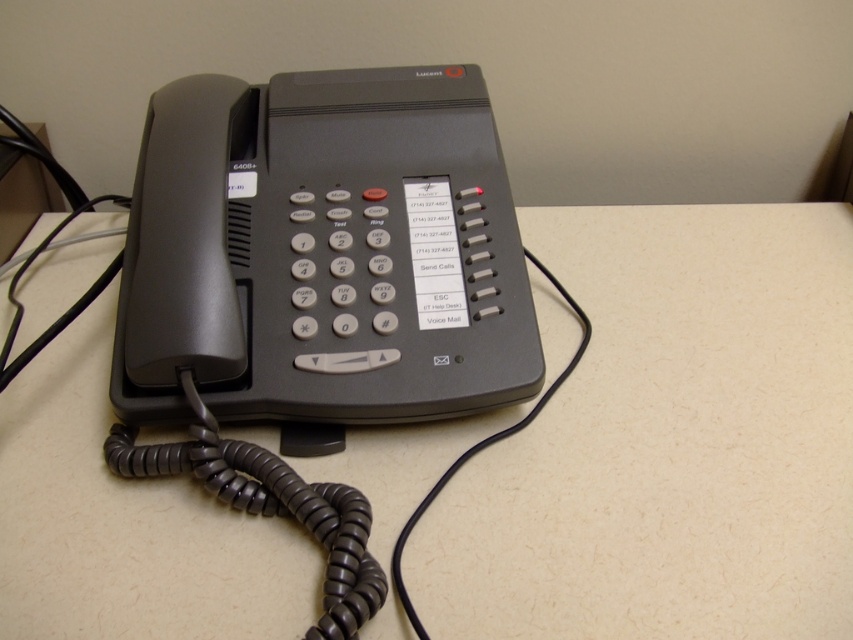
You are looking at the desk phone and need to press a key that is closer to you. Which point, point (633, 324) or point (219, 182), is closer to you?

Point (219, 182) is closer to you because it is less further to the camera than point (633, 324).

You are organizing a desk and need to place a beige matte table at center and a matte black telephone at center. According to the scene, where should you position the beige matte table relative to the matte black telephone?

The beige matte table at center should be positioned to the right of the matte black telephone at center as described in the scene.

You are organizing your desk and need to place a new phone. The current desk has a beige matte table at center. Where should you place the new phone to ensure it aligns with the existing setup?

The beige matte table at center is located at point (668,442), so you should place the new phone at the same coordinates to maintain alignment with the existing setup.